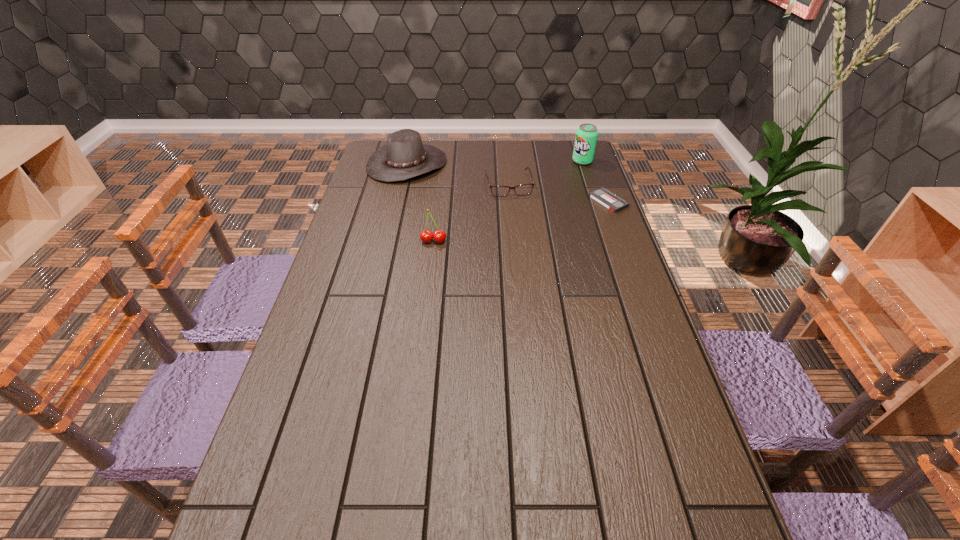
In order to click on free space located on the front-facing side of the pop soda in this screenshot , I will do `click(552, 187)`.

You are a GUI agent. You are given a task and a screenshot of the screen. Output one action in this format:
    pyautogui.click(x=<x>, y=<y>)
    Task: Click on the vacant point located on the lenses of the fourth tallest object
    The image size is (960, 540).
    Given the screenshot: What is the action you would take?
    pyautogui.click(x=516, y=212)

Find the location of a particular element. vacant space situated on the lenses of the fourth tallest object is located at coordinates 519,222.

Identify the location of free space located 0.270m on the lenses of the fourth tallest object. The height and width of the screenshot is (540, 960). (525, 244).

At what (x,y) coordinates should I click in order to perform the action: click on vacant space situated on the front-facing side of the hat. Please return your answer as a coordinate pair (x, y). The image size is (960, 540). Looking at the image, I should click on (474, 208).

Where is `vacant space positioned 0.370m on the front-facing side of the hat`? vacant space positioned 0.370m on the front-facing side of the hat is located at coordinates (495, 223).

At what (x,y) coordinates should I click in order to perform the action: click on vacant space positioned 0.230m on the front-facing side of the hat. Please return your answer as a coordinate pair (x, y). Image resolution: width=960 pixels, height=540 pixels. Looking at the image, I should click on (468, 205).

I want to click on pop soda at the far edge, so click(x=586, y=135).

Where is `hat located in the far edge section of the desktop`? hat located in the far edge section of the desktop is located at coordinates (404, 156).

The image size is (960, 540). What are the coordinates of `object present at the left edge` in the screenshot? It's located at (404, 156).